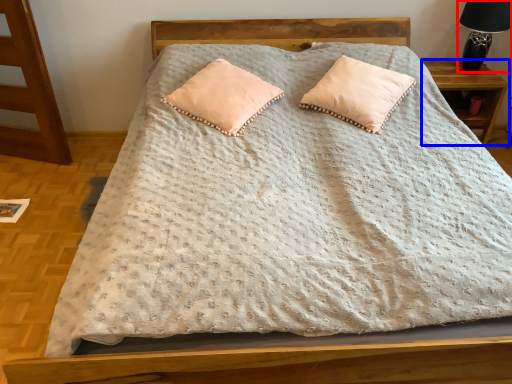
Question: Which point is closer to the camera, table lamp (highlighted by a red box) or nightstand (highlighted by a blue box)?

Choices:
 (A) table lamp
 (B) nightstand

Answer: (A)